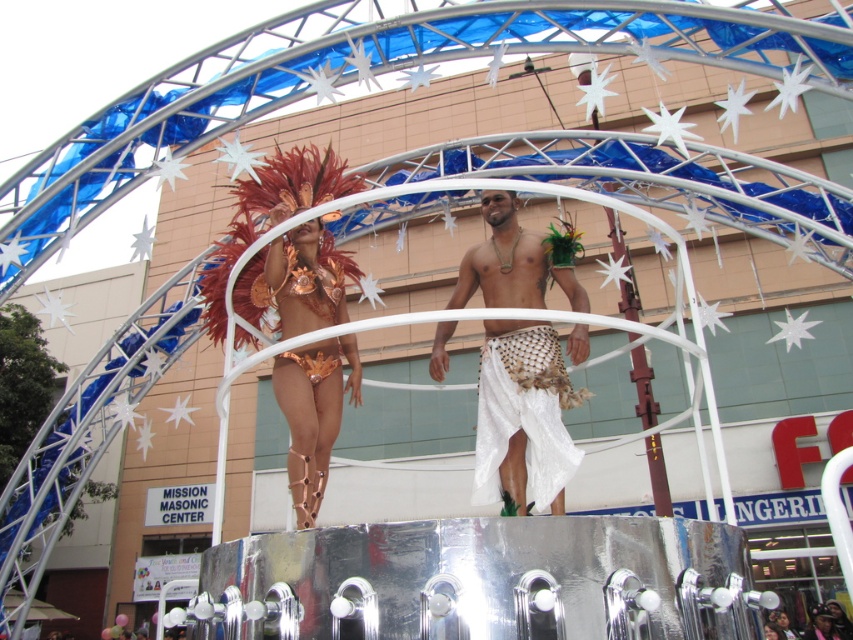
You are a photographer at the parade and want to capture the white woven cloth at center and the white woven skirt at center in a single shot. Which object should you focus on first to ensure both are in frame?

The white woven cloth at center is located above the white woven skirt at center, so focus on the white woven cloth at center first to ensure both are captured in the frame.

You are a photographer positioned at the edge of the parade route, aiming to capture a clear photo of both the white woven skirt at center and the metallic gold bikini at center. Given that your camera has a maximum focus range of 2 meters, will you be able to focus on both subjects simultaneously?

The white woven skirt at center is 2.39 meters away from the metallic gold bikini at center. Since the distance between them exceeds the camera maximum focus range of 2 meters, you cannot focus on both subjects simultaneously.

You are a photographer at the parade and want to capture the metallic gold bikini at center and the white woven skirt at center in the same frame. Based on their positions, which one will appear taller in the photo?

The white woven skirt at center has a greater height compared to the metallic gold bikini at center, so it will appear taller in the photo.